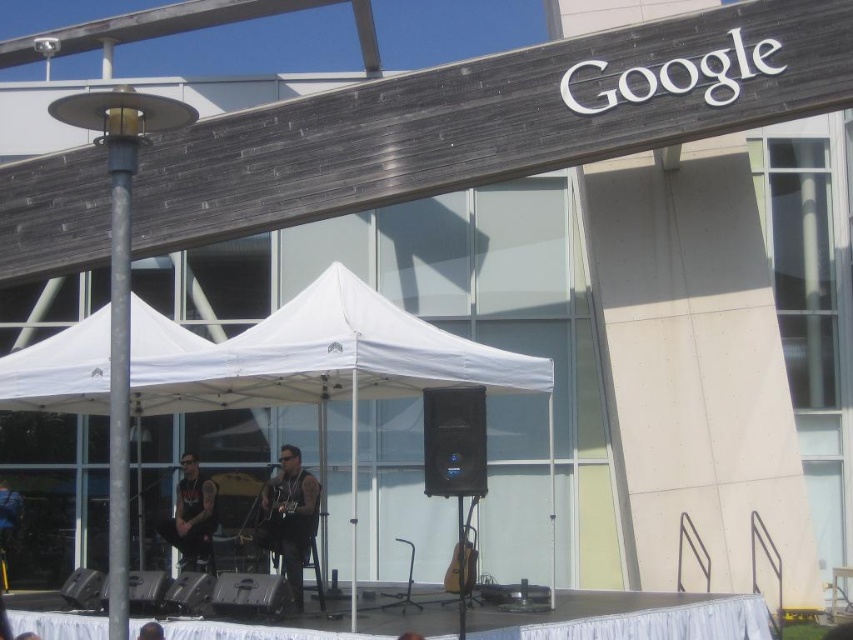
You are a photographer setting up for an event at the outdoor stage. You need to position a light source so that it illuminates the black leather vest at center without casting a shadow on the white fabric tent at center. Is this possible based on the current setup?

The white fabric tent at center is located above the black leather vest at center, so positioning a light source below the vest would illuminate it while avoiding casting a shadow on the tent above.

You are a photographer standing in front of the outdoor stage setup. You want to take a photo that includes both the point at position (132, 412) and the point at position (288, 516). Which point is closer to your camera?

Point at position (132, 412) is closer to the camera than point at position (288, 516) because it is further to the camera than the other point.

You are a photographer positioned in front of the stage. You want to take a photo that focuses on the black leather vest at center and the black leather jacket at center. Which one will appear larger in your photo?

The black leather vest at center will appear larger in the photo because it is closer to the viewer than the black leather jacket at center.